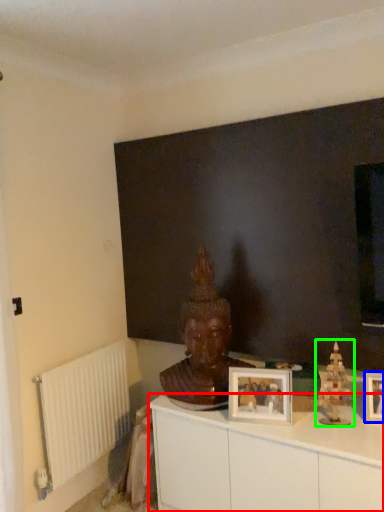
Question: Which is nearer to the cabinetry (highlighted by a red box)? picture frame (highlighted by a blue box) or toy (highlighted by a green box).

Choices:
 (A) picture frame
 (B) toy

Answer: (B)